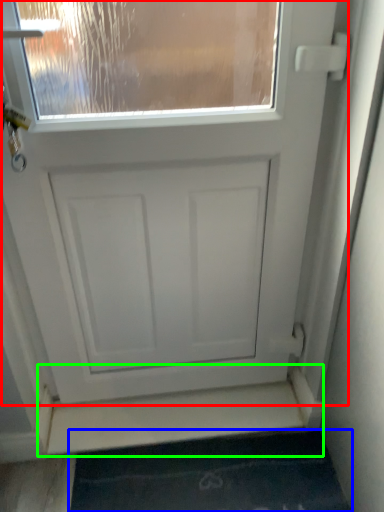
Question: Estimate the real-world distances between objects in this image. Which object is closer to door (highlighted by a red box), bath mat (highlighted by a blue box) or stairwell (highlighted by a green box)?

Choices:
 (A) bath mat
 (B) stairwell

Answer: (B)